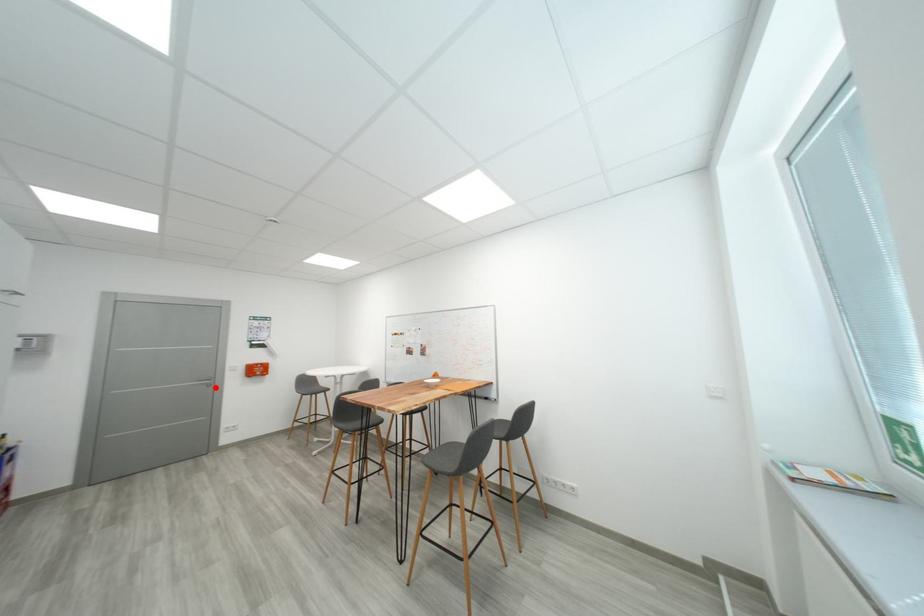
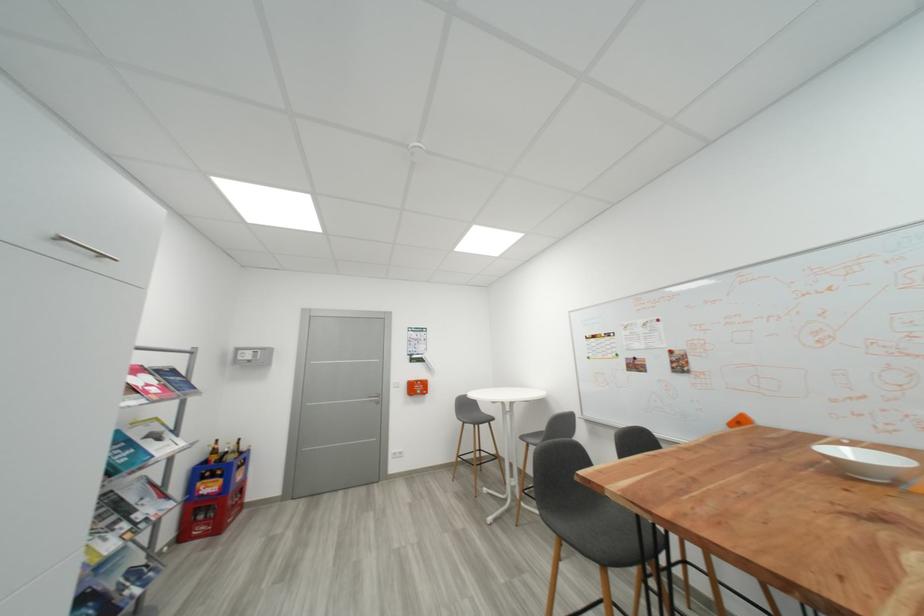
Question: A red point is marked in image1. In image2, is the corresponding 3D point closer to the camera or farther? Reply with the corresponding letter.

Choices:
 (A) The corresponding 3D point is closer.
 (B) The corresponding 3D point is farther.

Answer: (B)